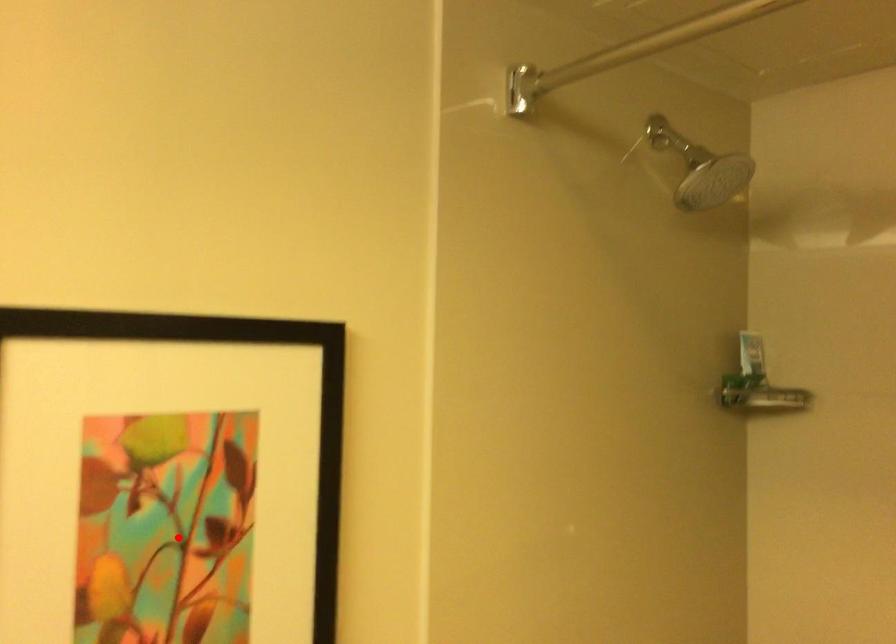
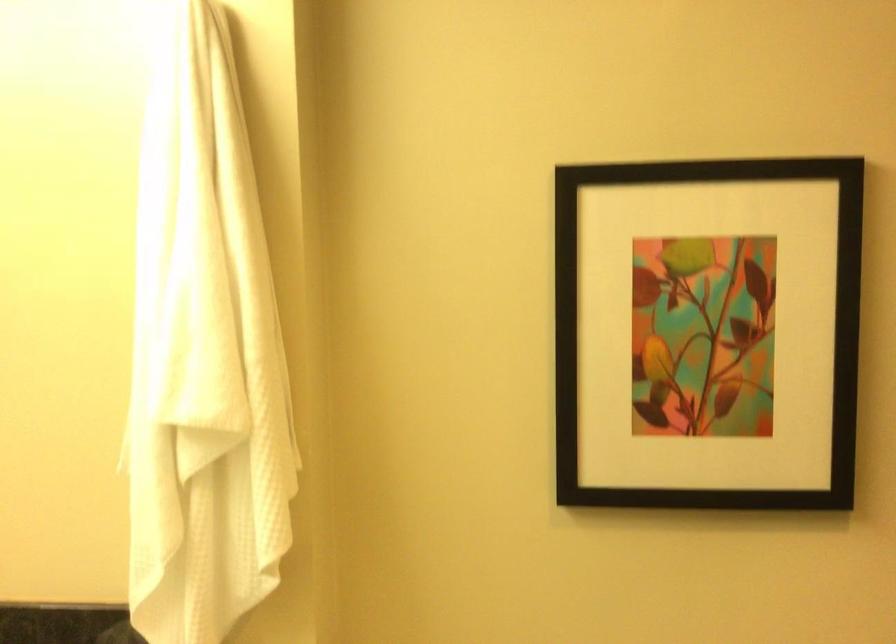
In the second image, find the point that corresponds to the highlighted location in the first image.

(708, 333)